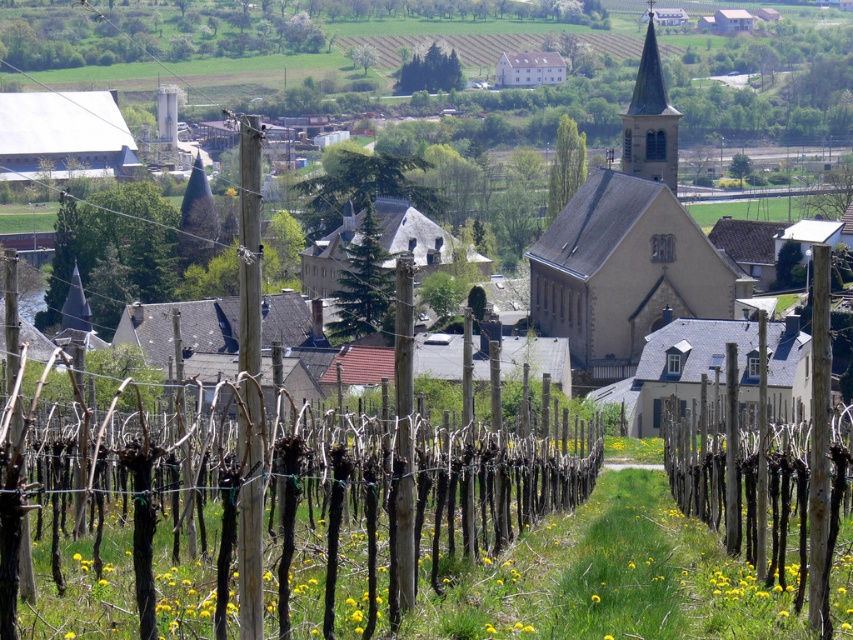
Question: Does brown wooden fence at lower right appear under brown wooden pole at center?

Choices:
 (A) no
 (B) yes

Answer: (B)

Question: Considering the real-world distances, which object is farthest from the brown wooden pole at center?

Choices:
 (A) brown wooden fence at center
 (B) brown wooden fence at lower right

Answer: (B)

Question: Does brown wooden fence at center have a lesser width compared to stone church at center?

Choices:
 (A) no
 (B) yes

Answer: (B)

Question: Which point is farther from the camera taking this photo?

Choices:
 (A) (824, 628)
 (B) (312, 518)
 (C) (671, 276)

Answer: (C)

Question: Can you confirm if stone church at center is wider than brown wooden pole at center?

Choices:
 (A) yes
 (B) no

Answer: (A)

Question: Which object is the closest to the brown wooden fence at center?

Choices:
 (A) smooth stone spire at upper center
 (B) brown wooden fence at lower right

Answer: (B)